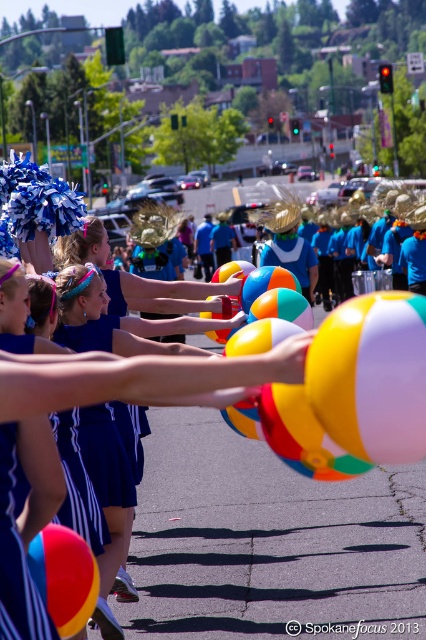
Does blue fabric uniform at center appear over multicolored glossy beach ball at center?

Correct, blue fabric uniform at center is located above multicolored glossy beach ball at center.

In the scene shown: Can you confirm if blue fabric uniform at center is smaller than multicolored glossy beach ball at center?

No.

Does point (83, 432) come farther from viewer compared to point (40, 548)?

Yes.

This screenshot has width=426, height=640. Identify the location of blue fabric uniform at center. (109, 456).

Does point (386, 352) come farther from viewer compared to point (32, 561)?

That is False.

Can you confirm if multicolored rubber beach ball at center is positioned below multicolored glossy beach ball at center?

No.

The height and width of the screenshot is (640, 426). What are the coordinates of `multicolored rubber beach ball at center` in the screenshot? It's located at (371, 376).

Where is `multicolored rubber beach ball at center`? This screenshot has height=640, width=426. multicolored rubber beach ball at center is located at coordinates (371, 376).

Who is lower down, multicolored rubber beach ball at center or blue fabric uniform at center?

Positioned lower is blue fabric uniform at center.

Is multicolored rubber beach ball at center thinner than blue fabric uniform at center?

No.

This screenshot has height=640, width=426. I want to click on multicolored rubber beach ball at center, so click(x=371, y=376).